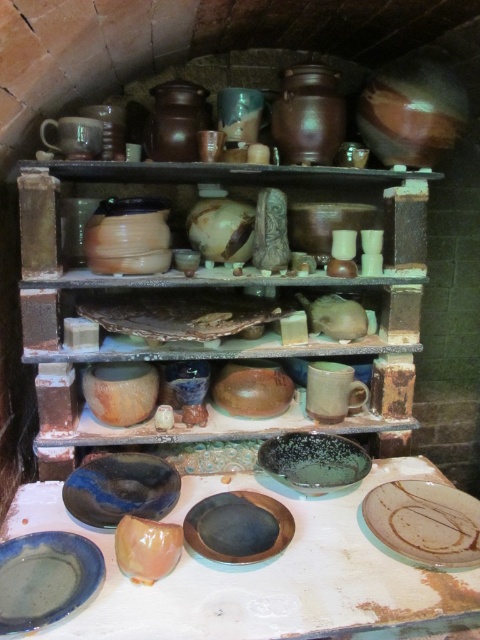
Question: Where is green matte plate at center located in relation to matte brown plate at center in the image?

Choices:
 (A) right
 (B) left

Answer: (A)

Question: Which of the following is the farthest from the observer?

Choices:
 (A) (447, 544)
 (B) (262, 445)
 (C) (332, 420)

Answer: (C)

Question: Is green matte plate at center positioned at the back of blue glossy plate at center?

Choices:
 (A) no
 (B) yes

Answer: (A)

Question: Which point is closer to the camera?

Choices:
 (A) (216, 513)
 (B) (336, 467)
 (C) (96, 476)
 (D) (191, 164)

Answer: (A)

Question: Can you confirm if matte ceramic plate at center is positioned above blue glossy plate at center?

Choices:
 (A) no
 (B) yes

Answer: (B)

Question: Which of the following is the closest to the observer?

Choices:
 (A) matte ceramic plate at center
 (B) matte clay mug at center
 (C) speckled ceramic plate at center
 (D) blue glossy plate at center

Answer: (D)